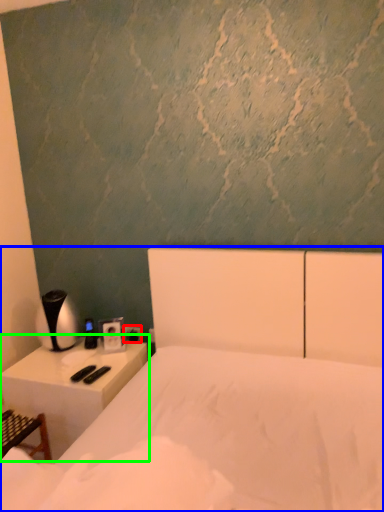
Question: Which object is the farthest from electric outlet (highlighted by a red box)? Choose among these: bed (highlighted by a blue box) or nightstand (highlighted by a green box).

Choices:
 (A) bed
 (B) nightstand

Answer: (A)